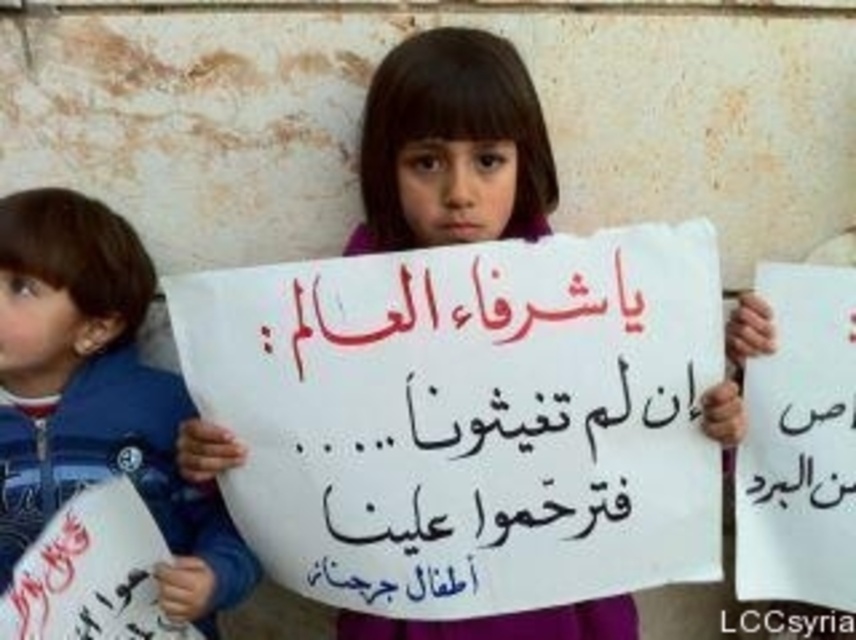
Question: Which point appears farthest from the camera in this image?

Choices:
 (A) (828, 547)
 (B) (110, 336)

Answer: (B)

Question: Is white paper sign at center to the left of white paper at right from the viewer's perspective?

Choices:
 (A) yes
 (B) no

Answer: (A)

Question: Does blue fleece jacket at left appear on the right side of white paper sign at center?

Choices:
 (A) yes
 (B) no

Answer: (B)

Question: Which object is closer to the camera taking this photo?

Choices:
 (A) white paper sign at center
 (B) white paper at right
 (C) blue fleece jacket at left

Answer: (C)

Question: Which of the following is the farthest from the observer?

Choices:
 (A) (432, 237)
 (B) (110, 380)
 (C) (756, 483)

Answer: (B)

Question: Considering the relative positions of blue fleece jacket at left and white paper sign at center in the image provided, where is blue fleece jacket at left located with respect to white paper sign at center?

Choices:
 (A) below
 (B) above

Answer: (A)